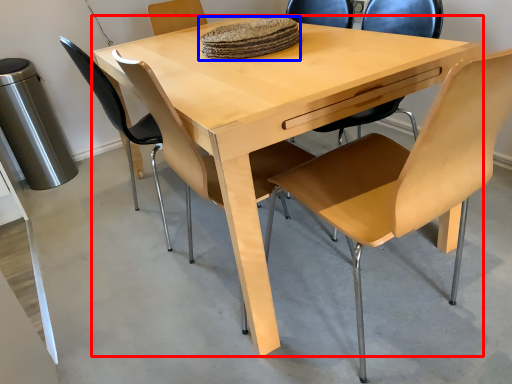
Question: Among these objects, which one is nearest to the camera, table (highlighted by a red box) or food (highlighted by a blue box)?

Choices:
 (A) table
 (B) food

Answer: (A)